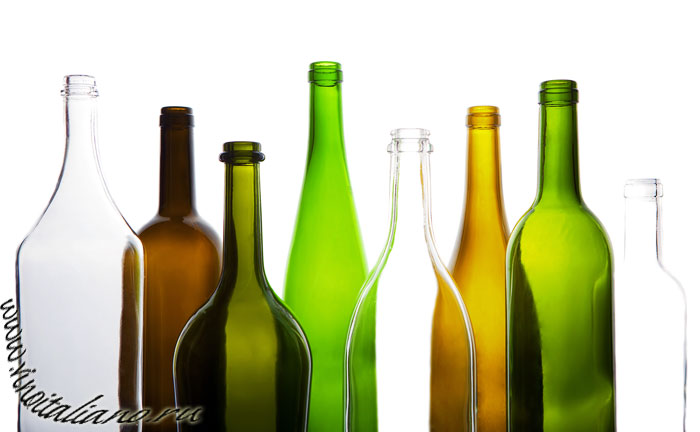
Find the location of a particular element. This screenshot has height=432, width=700. bottles on the left side is located at coordinates (94, 308), (171, 293), (246, 324), (316, 290).